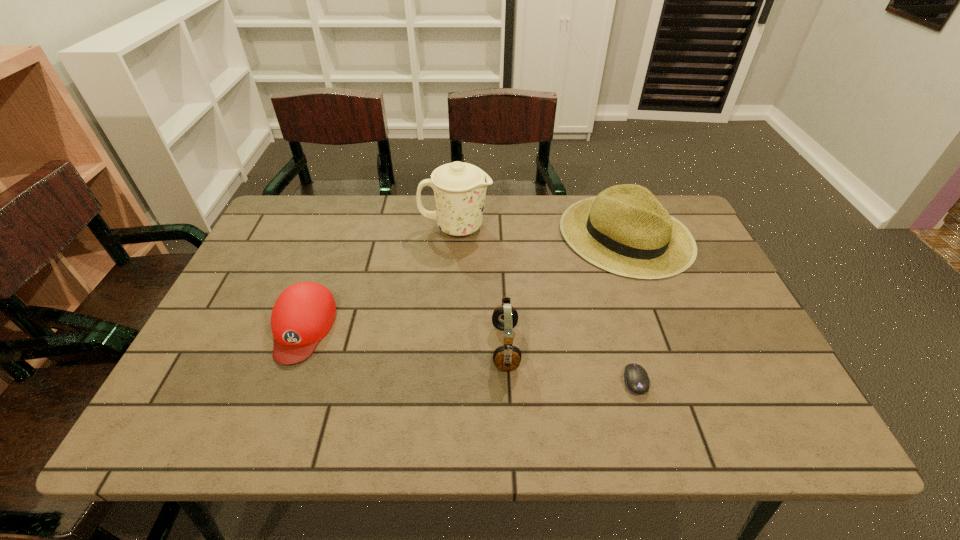
Identify the location of vacant region between the headset and the computer mouse. (570, 364).

Where is `free space between the second shortest object and the headset`? Image resolution: width=960 pixels, height=540 pixels. free space between the second shortest object and the headset is located at coordinates (404, 338).

Locate an element on the screen. This screenshot has width=960, height=540. free area in between the leftmost object and the headset is located at coordinates (404, 338).

Locate an element on the screen. Image resolution: width=960 pixels, height=540 pixels. empty space that is in between the leftmost object and the headset is located at coordinates (404, 338).

The image size is (960, 540). Identify the location of object that is the second closest one to the headset. coord(637,381).

Locate which object ranks second in proximity to the second shortest object. Please provide its 2D coordinates. Your answer should be formatted as a tuple, i.e. [(x, y)], where the tuple contains the x and y coordinates of a point satisfying the conditions above.

[(505, 317)]

Identify the location of free space that satisfies the following two spatial constraints: 1. on the front side of the sunhat; 2. on the ear cups of the headset. The height and width of the screenshot is (540, 960). (668, 347).

At what (x,y) coordinates should I click in order to perform the action: click on free space that satisfies the following two spatial constraints: 1. on the ear cups of the headset; 2. on the left side of the computer mouse. Please return your answer as a coordinate pair (x, y). The image size is (960, 540). Looking at the image, I should click on (507, 381).

Where is `vacant space that satisfies the following two spatial constraints: 1. on the back side of the computer mouse; 2. on the spout of the tallest object`? This screenshot has width=960, height=540. vacant space that satisfies the following two spatial constraints: 1. on the back side of the computer mouse; 2. on the spout of the tallest object is located at coordinates (590, 227).

Where is `vacant region that satisfies the following two spatial constraints: 1. on the spout of the tallest object; 2. on the left side of the sunhat`? This screenshot has height=540, width=960. vacant region that satisfies the following two spatial constraints: 1. on the spout of the tallest object; 2. on the left side of the sunhat is located at coordinates (455, 235).